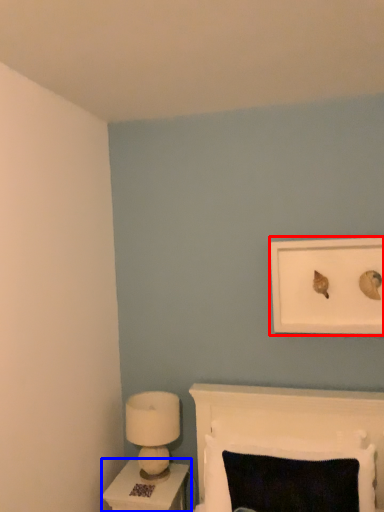
Question: Which object appears farthest to the camera in this image, picture frame (highlighted by a red box) or nightstand (highlighted by a blue box)?

Choices:
 (A) picture frame
 (B) nightstand

Answer: (B)